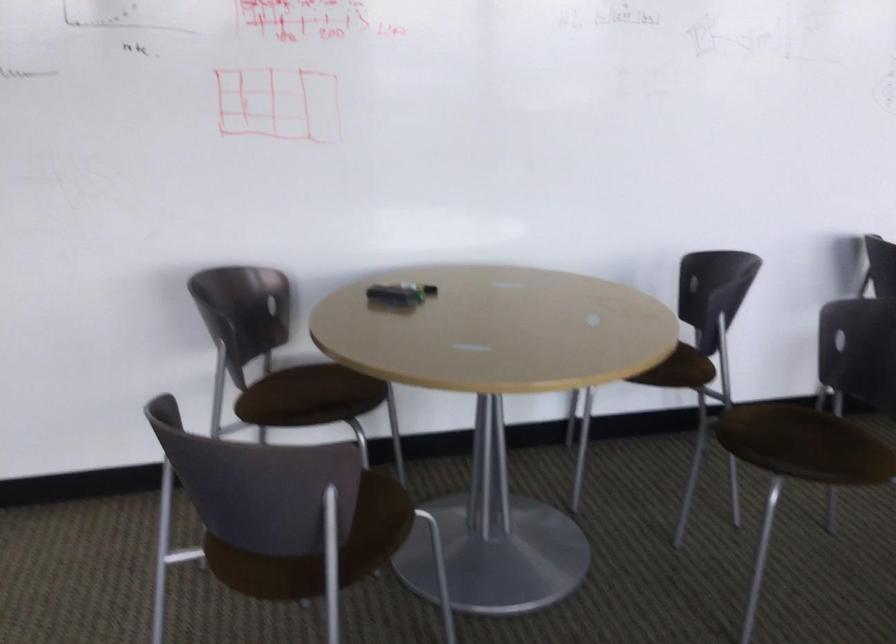
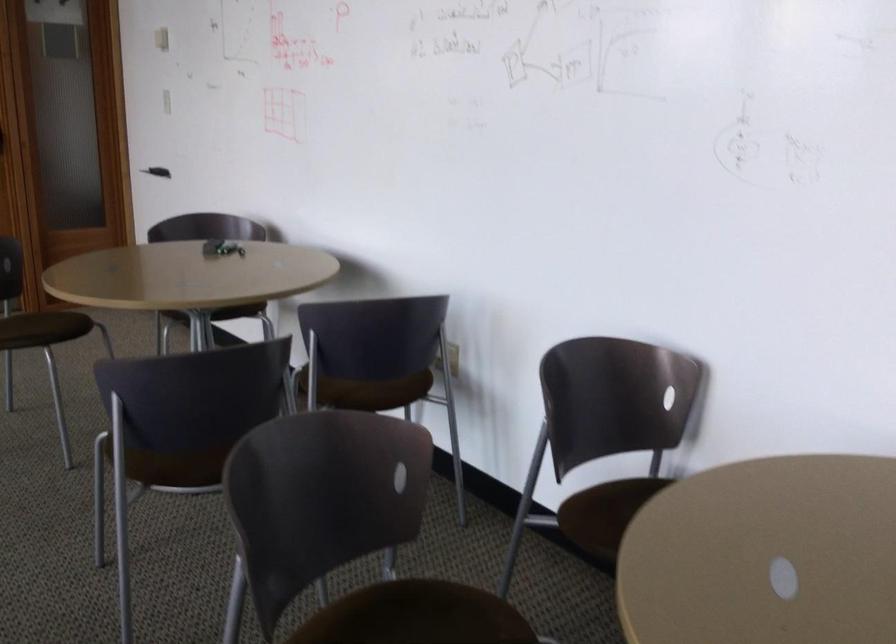
Question: I am providing you with two images of the same scene from different viewpoints. After the viewpoint changes to image2, which objects are now occluded?

Choices:
 (A) set of keys
 (B) white and red box
 (C) white light switch
 (D) brown chair sitting surface

Answer: (D)